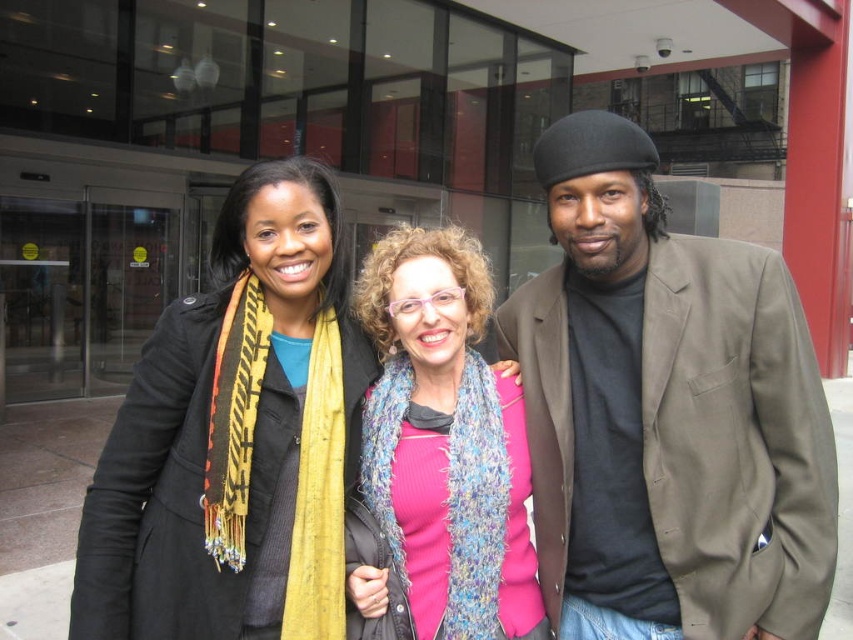
Does matte black coat at center have a lesser width compared to pink knitted scarf at center?

Incorrect, matte black coat at center's width is not less than pink knitted scarf at center's.

Is point (234, 461) in front of point (462, 563)?

Yes, it is in front of point (462, 563).

Does point (178, 436) lie behind point (515, 438)?

No.

Identify the location of matte black coat at center. (235, 436).

Who is higher up, matte brown blazer at center or pink knitted scarf at center?

matte brown blazer at center

Between point (564, 392) and point (407, 365), which one is positioned in front?

Positioned in front is point (564, 392).

Locate an element on the screen. The height and width of the screenshot is (640, 853). matte brown blazer at center is located at coordinates (666, 413).

Which is above, matte brown blazer at center or matte black coat at center?

matte brown blazer at center is higher up.

Looking at this image, who is lower down, matte brown blazer at center or matte black coat at center?

matte black coat at center is below.

Is point (651, 209) in front of point (368, 346)?

That is True.

Where is `matte brown blazer at center`? matte brown blazer at center is located at coordinates (666, 413).